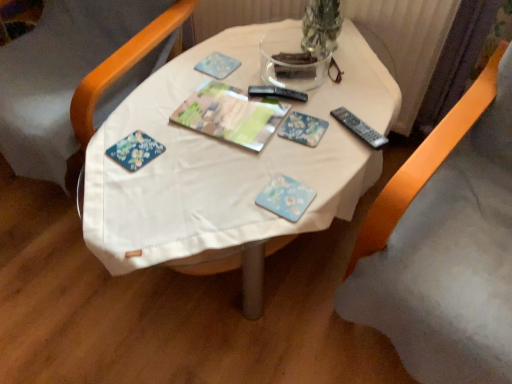
Where is `free space between floral-patterned paper at center-left and floral-patterned paper at center, positioned as the first paperback book in back-to-front order`? This screenshot has width=512, height=384. free space between floral-patterned paper at center-left and floral-patterned paper at center, positioned as the first paperback book in back-to-front order is located at coordinates (214, 144).